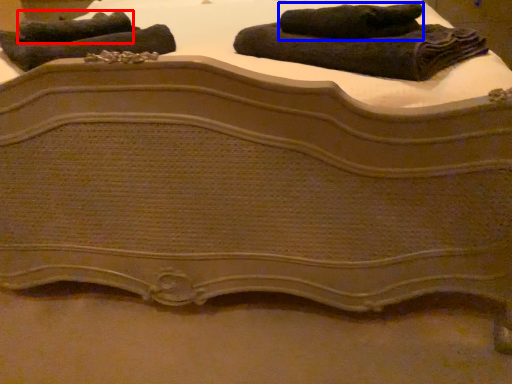
Question: Which of the following is the closest to the observer, towel (highlighted by a red box) or towel (highlighted by a blue box)?

Choices:
 (A) towel
 (B) towel

Answer: (B)